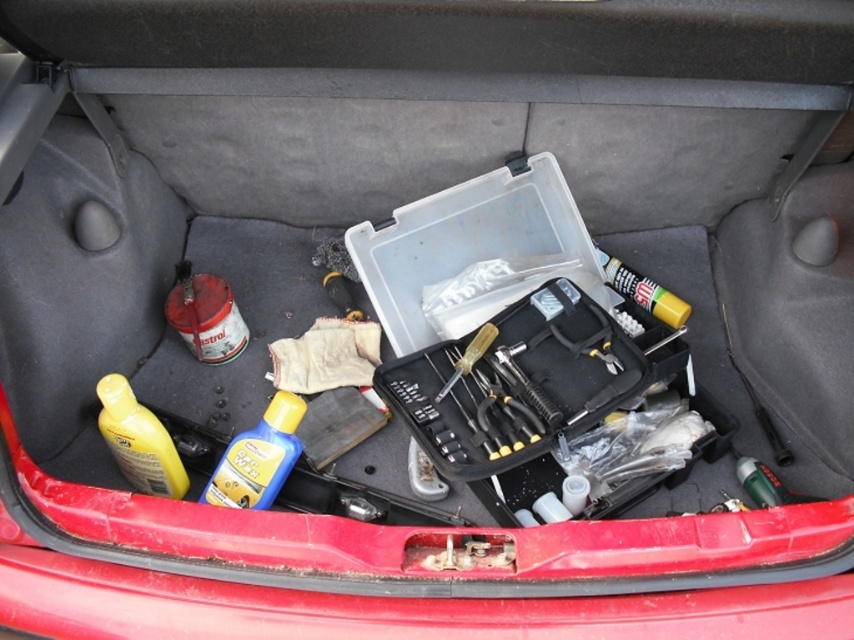
Is yellow matte bottle at lower left in front of metallic screwdriver at center?

That is True.

Who is more distant from viewer, (133, 456) or (434, 401)?

The point (434, 401) is more distant.

The width and height of the screenshot is (854, 640). I want to click on yellow matte bottle at lower left, so click(138, 440).

Between yellow glossy bottle at lower left and metallic screwdriver at center, which one appears on the right side from the viewer's perspective?

From the viewer's perspective, metallic screwdriver at center appears more on the right side.

Can you confirm if yellow glossy bottle at lower left is wider than metallic screwdriver at center?

Indeed, yellow glossy bottle at lower left has a greater width compared to metallic screwdriver at center.

Identify the location of yellow glossy bottle at lower left. Image resolution: width=854 pixels, height=640 pixels. (258, 458).

Does yellow glossy bottle at lower left come in front of yellow matte bottle at lower left?

No.

Can you confirm if yellow glossy bottle at lower left is wider than yellow matte bottle at lower left?

Yes.

The width and height of the screenshot is (854, 640). Identify the location of yellow glossy bottle at lower left. (258, 458).